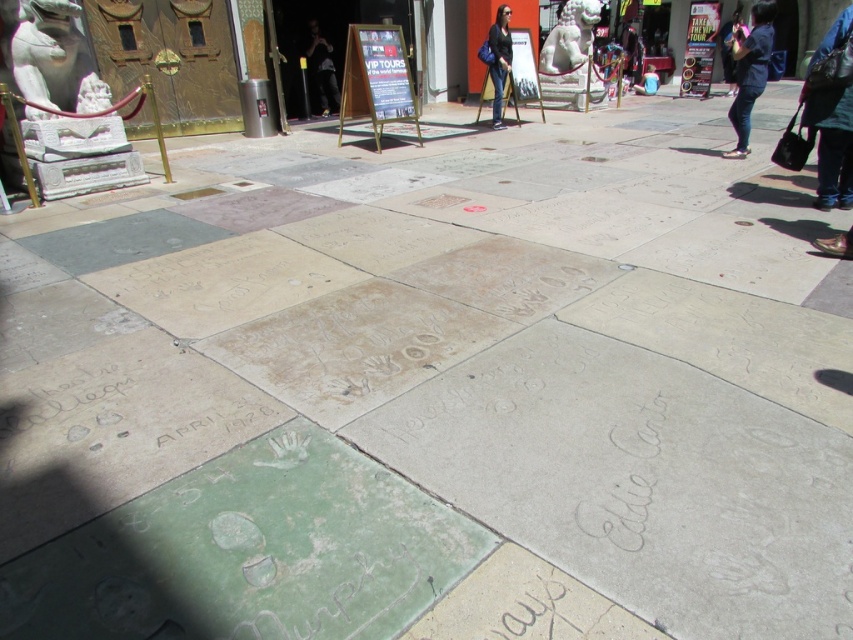
Question: Can you confirm if white marble statue at upper left is positioned to the right of blue fabric jacket at upper right?

Choices:
 (A) no
 (B) yes

Answer: (A)

Question: Can you confirm if green chalk writing at lower center is smaller than matte black jacket at center?

Choices:
 (A) no
 (B) yes

Answer: (B)

Question: Which point is closer to the camera taking this photo?

Choices:
 (A) (47, 83)
 (B) (241, 403)

Answer: (B)

Question: Which point appears closest to the camera in this image?

Choices:
 (A) (602, 104)
 (B) (44, 102)

Answer: (B)

Question: Which of the following is the farthest from the observer?

Choices:
 (A) white marble statue at upper left
 (B) dark blue jeans at right

Answer: (B)

Question: Is white marble statue at upper center thinner than matte black jacket at center?

Choices:
 (A) yes
 (B) no

Answer: (B)